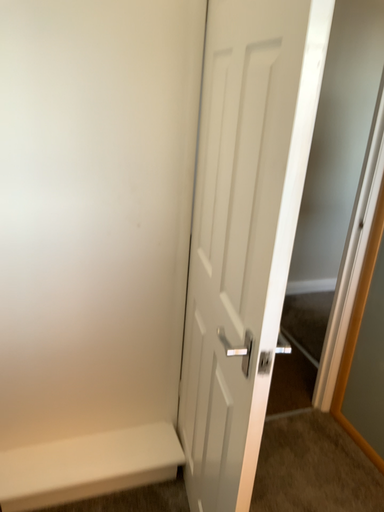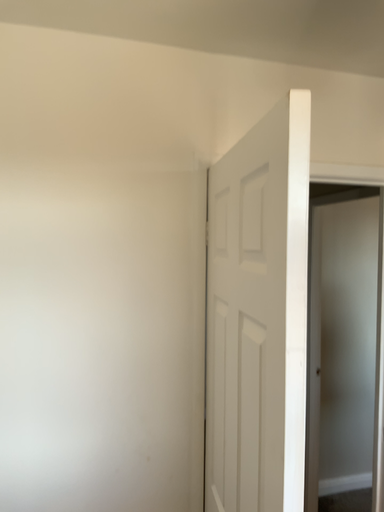
Question: Which way did the camera rotate in the video?

Choices:
 (A) rotated downward
 (B) rotated upward

Answer: (B)